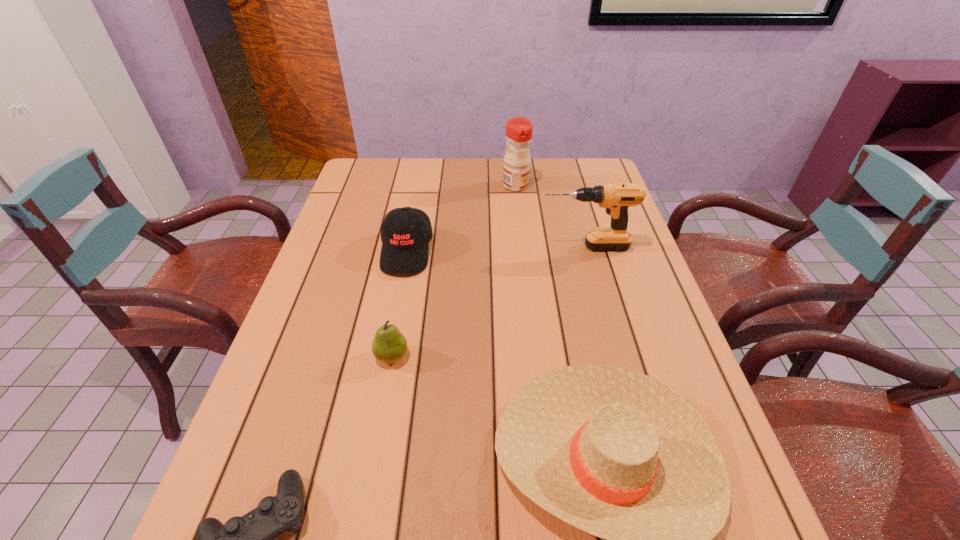
Locate an element on the screen. The width and height of the screenshot is (960, 540). vacant area that lies between the condiment and the drill is located at coordinates (550, 217).

Identify the location of free space between the baseball cap and the drill. (495, 249).

Identify the location of the fourth closest object to the condiment. (616, 453).

Where is `object that is the fourth closest to the control`? The width and height of the screenshot is (960, 540). object that is the fourth closest to the control is located at coordinates (616, 198).

Where is `vacant position in the image that satisfies the following two spatial constraints: 1. on the front-facing side of the baseball cap; 2. on the right side of the pear`? The height and width of the screenshot is (540, 960). vacant position in the image that satisfies the following two spatial constraints: 1. on the front-facing side of the baseball cap; 2. on the right side of the pear is located at coordinates (387, 356).

Identify the location of free space that satisfies the following two spatial constraints: 1. at the tip of the drill; 2. on the front-facing side of the baseball cap. The height and width of the screenshot is (540, 960). (586, 252).

Where is `free space that satisfies the following two spatial constraints: 1. on the front-facing side of the baseball cap; 2. on the left side of the pear`? Image resolution: width=960 pixels, height=540 pixels. free space that satisfies the following two spatial constraints: 1. on the front-facing side of the baseball cap; 2. on the left side of the pear is located at coordinates (387, 356).

Where is `free spot that satisfies the following two spatial constraints: 1. on the front-facing side of the pear; 2. on the right side of the baseball cap`? Image resolution: width=960 pixels, height=540 pixels. free spot that satisfies the following two spatial constraints: 1. on the front-facing side of the pear; 2. on the right side of the baseball cap is located at coordinates (387, 356).

In order to click on free space that satisfies the following two spatial constraints: 1. on the back side of the condiment; 2. on the left side of the pear in this screenshot , I will do `click(422, 186)`.